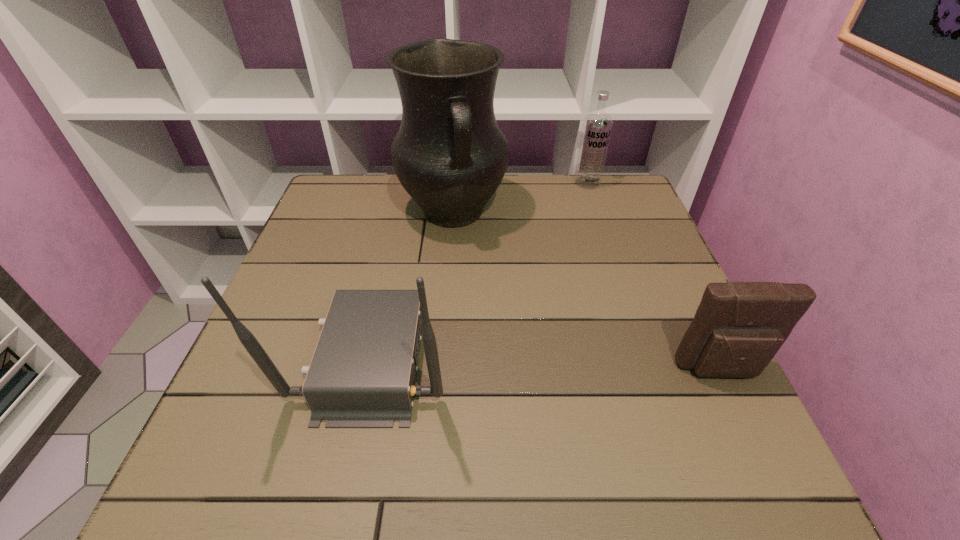
The height and width of the screenshot is (540, 960). Identify the location of vacant space located on the front label of the vodka. (589, 264).

Locate an element on the screen. free region located 0.180m on the front label of the vodka is located at coordinates (588, 226).

What are the coordinates of `vacant region located on the front label of the vodka` in the screenshot? It's located at (588, 201).

Where is `pitcher located in the far edge section of the desktop`? The height and width of the screenshot is (540, 960). pitcher located in the far edge section of the desktop is located at coordinates (449, 154).

Locate an element on the screen. vodka that is at the far edge is located at coordinates (597, 126).

This screenshot has width=960, height=540. Identify the location of object that is positioned at the near edge. (363, 372).

At what (x,y) coordinates should I click in order to perform the action: click on object that is at the left edge. Please return your answer as a coordinate pair (x, y). The height and width of the screenshot is (540, 960). Looking at the image, I should click on (363, 372).

Locate an element on the screen. The height and width of the screenshot is (540, 960). pouch that is positioned at the right edge is located at coordinates (738, 328).

Where is `vodka situated at the right edge`? This screenshot has height=540, width=960. vodka situated at the right edge is located at coordinates (597, 126).

This screenshot has width=960, height=540. What are the coordinates of `object at the near left corner` in the screenshot? It's located at (363, 372).